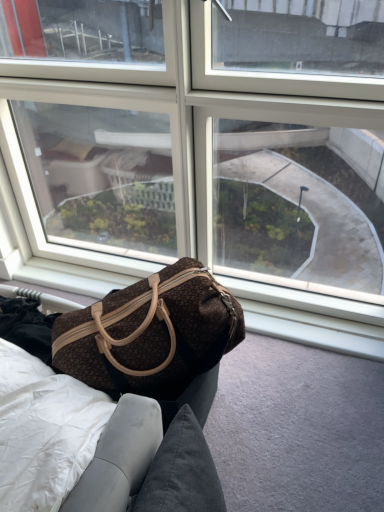
Question: From the image's perspective, is transparent glass window at center beneath brown fabric bag at lower left?

Choices:
 (A) yes
 (B) no

Answer: (B)

Question: Could you tell me if transparent glass window at center is facing brown fabric bag at lower left?

Choices:
 (A) yes
 (B) no

Answer: (A)

Question: Can you confirm if transparent glass window at center is bigger than brown fabric bag at lower left?

Choices:
 (A) yes
 (B) no

Answer: (A)

Question: From a real-world perspective, is transparent glass window at center below brown fabric bag at lower left?

Choices:
 (A) no
 (B) yes

Answer: (A)

Question: Considering the relative positions of transparent glass window at center and brown fabric bag at lower left in the image provided, is transparent glass window at center to the right of brown fabric bag at lower left from the viewer's perspective?

Choices:
 (A) yes
 (B) no

Answer: (B)

Question: From the image's perspective, is transparent glass window at center on top of brown fabric bag at lower left?

Choices:
 (A) yes
 (B) no

Answer: (A)

Question: Does brown fabric bag at lower left have a greater height compared to brown textured fabric bag at center?

Choices:
 (A) yes
 (B) no

Answer: (B)

Question: From a real-world perspective, does brown fabric bag at lower left sit lower than brown textured fabric bag at center?

Choices:
 (A) no
 (B) yes

Answer: (B)

Question: Can you confirm if brown fabric bag at lower left is thinner than brown textured fabric bag at center?

Choices:
 (A) yes
 (B) no

Answer: (B)

Question: Considering the relative positions of brown fabric bag at lower left and brown textured fabric bag at center in the image provided, is brown fabric bag at lower left to the right of brown textured fabric bag at center from the viewer's perspective?

Choices:
 (A) yes
 (B) no

Answer: (A)

Question: Is brown fabric bag at lower left positioned with its back to brown textured fabric bag at center?

Choices:
 (A) no
 (B) yes

Answer: (A)

Question: Can you confirm if brown fabric bag at lower left is shorter than brown textured fabric bag at center?

Choices:
 (A) no
 (B) yes

Answer: (B)

Question: From a real-world perspective, does brown textured fabric bag at center sit lower than brown fabric bag at lower left?

Choices:
 (A) yes
 (B) no

Answer: (B)